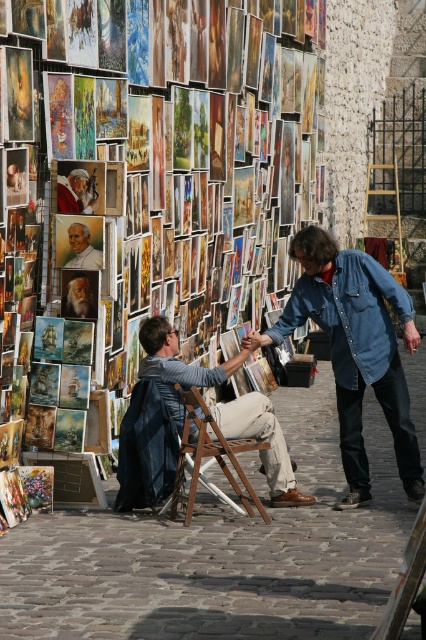
You are a photographer trying to capture the perfect shot of the wooden folding chair at center. If you want to position your camera exactly at the same location as the chair, what coordinates should you aim for?

The wooden folding chair at center is located at coordinates point [210,458], so you should position your camera at those coordinates to match the chair.

You are a visitor at an art exhibition and see the wooden folding chair at center and the matte red jacket at center. Which object is located to the right of the other?

The wooden folding chair at center is to the right of the matte red jacket at center.